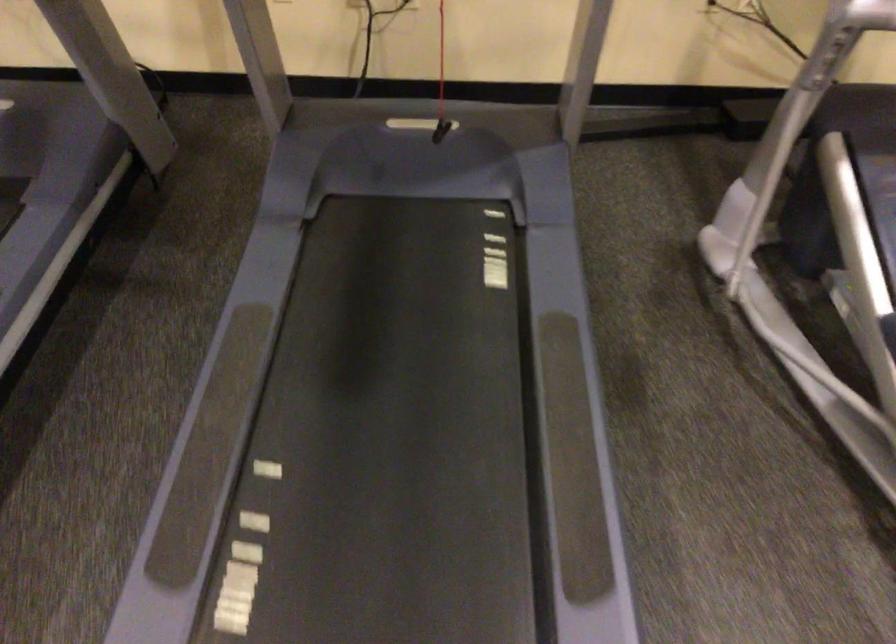
Find where to pull the red safety cord. Please return your answer as a coordinate pair (x, y).

(442, 86)